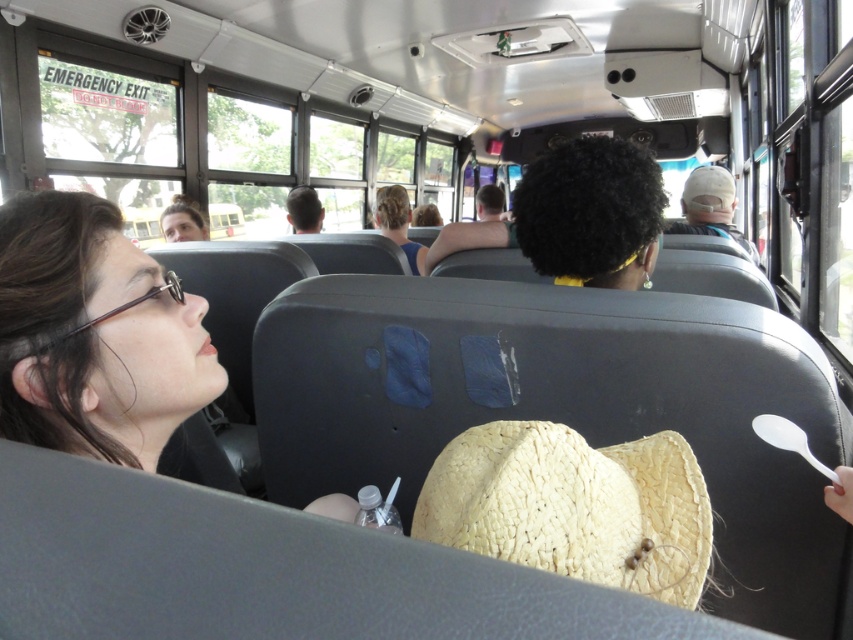
Question: Where is matte black hair at left located in relation to woven straw cowboy hat at center in the image?

Choices:
 (A) above
 (B) below

Answer: (A)

Question: Which object appears farthest from the camera in this image?

Choices:
 (A) woven straw cowboy hat at center
 (B) white plastic spoon at lower right
 (C) straw hat at upper center

Answer: (C)

Question: Which of the following is the closest to the observer?

Choices:
 (A) matte black hair at left
 (B) white plastic spoon at lower right
 (C) straw hat at upper center

Answer: (A)

Question: Is woven straw cowboy hat at center smaller than white plastic spoon at lower right?

Choices:
 (A) no
 (B) yes

Answer: (A)

Question: Does matte black hair at left appear on the right side of white plastic spoon at lower right?

Choices:
 (A) no
 (B) yes

Answer: (A)

Question: Which of the following is the farthest from the observer?

Choices:
 (A) (160, 314)
 (B) (784, 449)
 (C) (730, 179)
 (D) (480, 548)

Answer: (C)